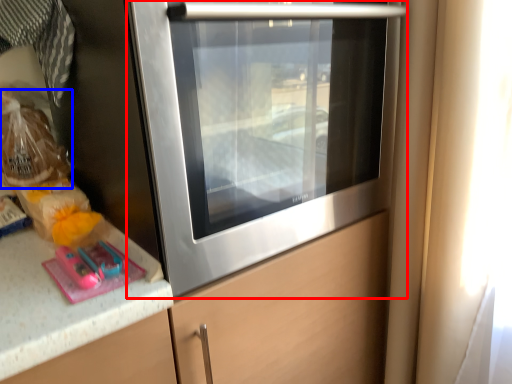
Question: Which object is further to the camera taking this photo, home appliance (highlighted by a red box) or food (highlighted by a blue box)?

Choices:
 (A) home appliance
 (B) food

Answer: (B)